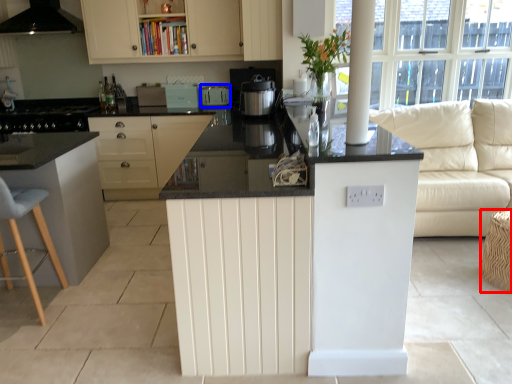
Question: Which object appears closest to the camera in this image, bar stool (highlighted by a red box) or appliance (highlighted by a blue box)?

Choices:
 (A) bar stool
 (B) appliance

Answer: (A)